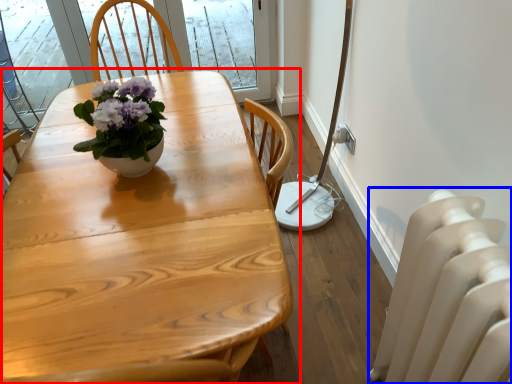
Question: Which point is closer to the camera, table (highlighted by a red box) or radiator (highlighted by a blue box)?

Choices:
 (A) table
 (B) radiator

Answer: (A)